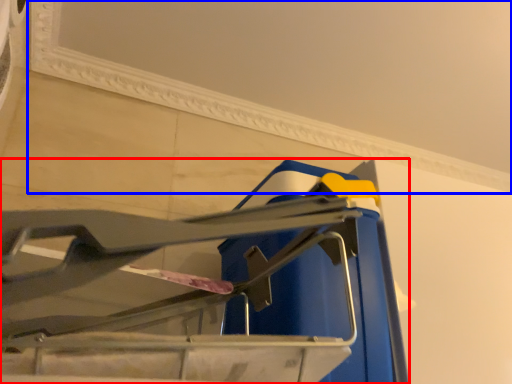
Question: Which of the following is the farthest to the observer, furniture (highlighted by a red box) or window frame (highlighted by a blue box)?

Choices:
 (A) furniture
 (B) window frame

Answer: (B)